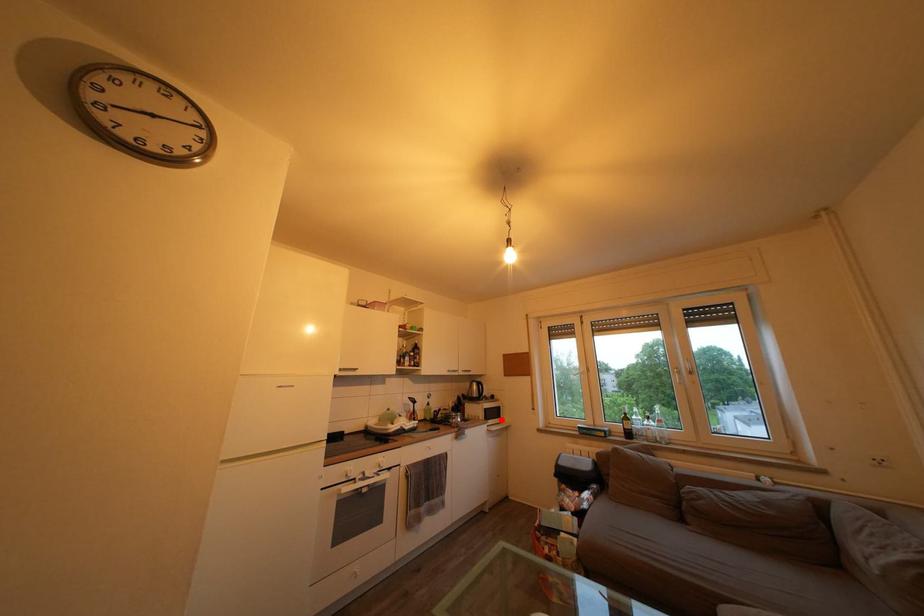
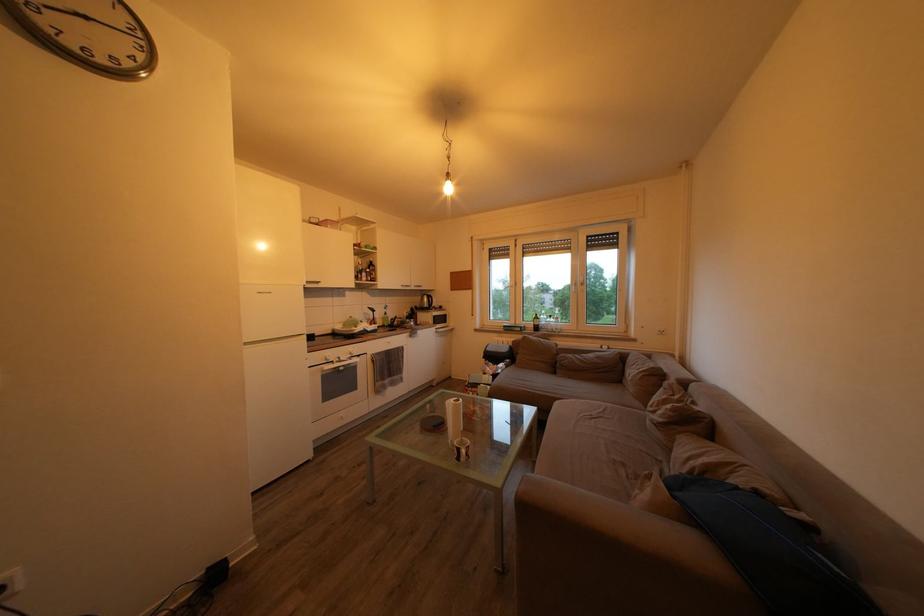
Question: I am providing you with two images of the same scene from different viewpoints. Given a red point in image1, look at the same physical point in image2. Is it:

Choices:
 (A) Closer to the viewpoint
 (B) Farther from the viewpoint

Answer: (A)